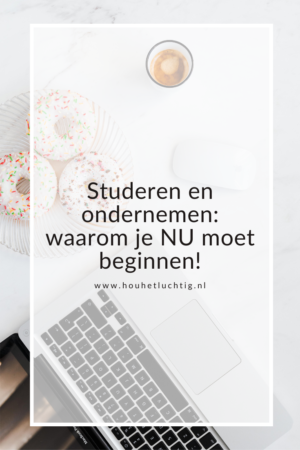
Locate an element on the screen. laptop is located at coordinates (50, 433).